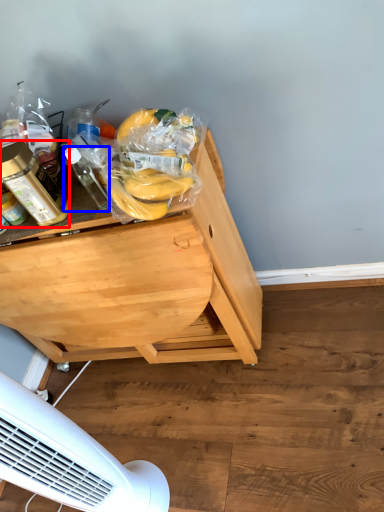
Question: Which of the following is the closest to the observer, bottle (highlighted by a red box) or bottle (highlighted by a blue box)?

Choices:
 (A) bottle
 (B) bottle

Answer: (B)